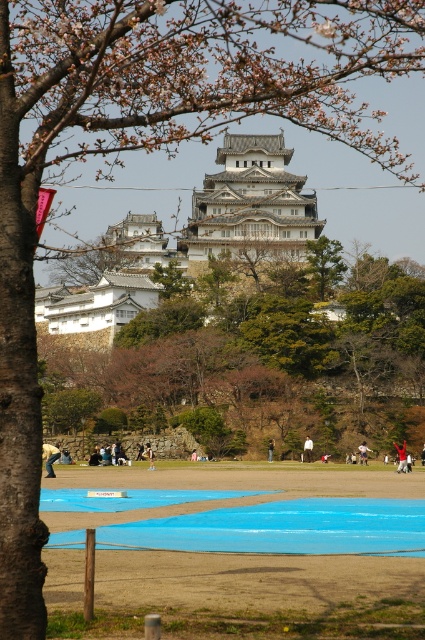
You are a visitor at Himeji Castle and want to take a photo of the red fabric person at center without the blue painted ground at center appearing in the background. Is this possible?

The blue painted ground at center is positioned under the red fabric person at center, so it would be challenging to capture the red fabric person at center without the blue painted ground at center in the background as they are spatially connected.

You are planning to host a small picnic at Himeji Castle and have brought a picnic blanket. You see the blue painted ground at center and the red fabric person at center in the area. Which location would be more suitable for placing your picnic blanket, and why?

The blue painted ground at center is larger in size than the red fabric person at center, making it a more suitable location for placing the picnic blanket as it provides enough space.